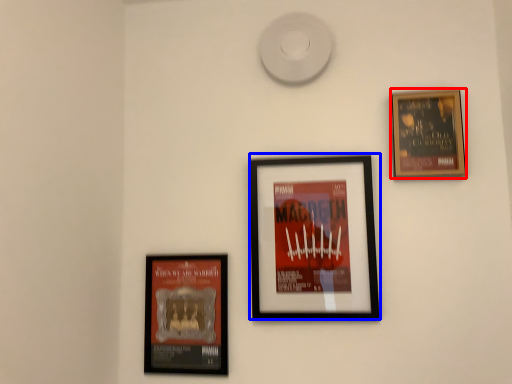
Question: Which of the following is the farthest to the observer, picture frame (highlighted by a red box) or picture frame (highlighted by a blue box)?

Choices:
 (A) picture frame
 (B) picture frame

Answer: (A)